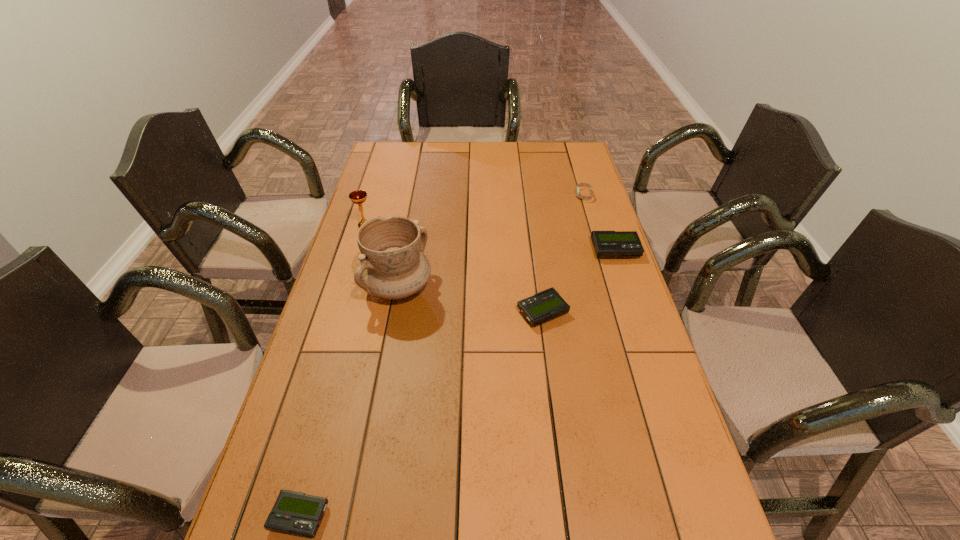
You are a GUI agent. You are given a task and a screenshot of the screen. Output one action in this format:
    pyautogui.click(x=<x>, y=<y>)
    Task: Click on the vacant space located 0.280m on the face of the farthest object
    The height and width of the screenshot is (540, 960).
    Given the screenshot: What is the action you would take?
    pyautogui.click(x=502, y=195)

At what (x,y) coordinates should I click in order to perform the action: click on vacant space located 0.080m on the face of the farthest object. Please return your answer as a coordinate pair (x, y). The height and width of the screenshot is (540, 960). Looking at the image, I should click on (554, 195).

Locate an element on the screen. vacant region located on the face of the farthest object is located at coordinates (520, 195).

In order to click on free space located on the back of the second farthest object in this screenshot , I will do `click(384, 168)`.

Find the location of `free location located 0.110m on the front of the pottery`. free location located 0.110m on the front of the pottery is located at coordinates pos(388,344).

The image size is (960, 540). I want to click on chalice that is at the left edge, so click(x=358, y=197).

Locate an element on the screen. pottery located in the left edge section of the desktop is located at coordinates click(392, 265).

Find the location of a particular element. beeper at the right edge is located at coordinates (606, 244).

Locate an element on the screen. watch located in the right edge section of the desktop is located at coordinates (586, 184).

Locate an element on the screen. vacant area at the far edge of the desktop is located at coordinates (455, 165).